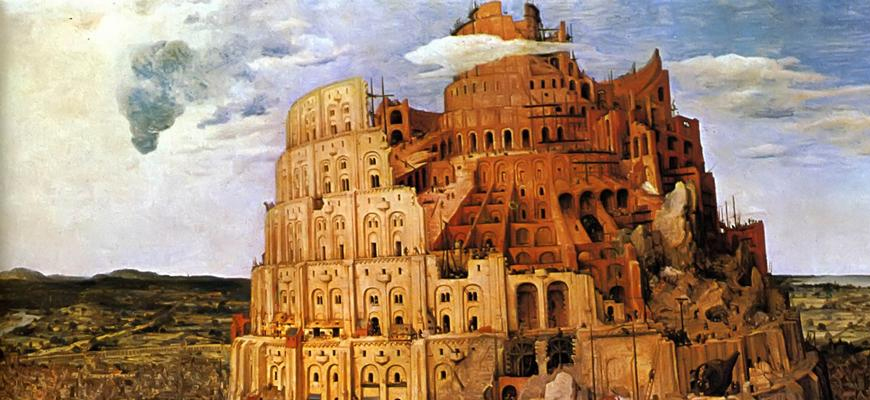
This screenshot has height=400, width=870. What are the coordinates of `window` in the screenshot? It's located at (445, 373).